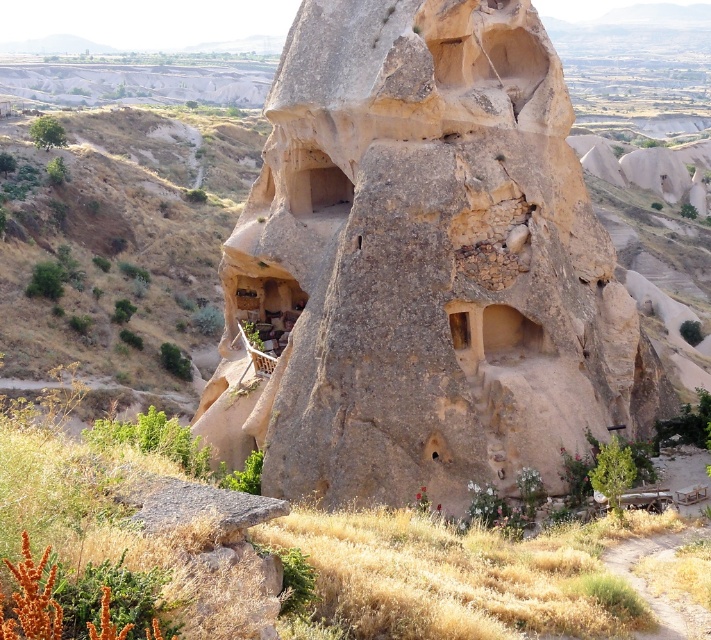
Who is positioned more to the left, brown rough rock formation at center or brown rough rock at lower left?

Positioned to the left is brown rough rock at lower left.

Between point (341, 237) and point (97, 186), which one is positioned behind?

Point (97, 186)

I want to click on brown rough rock formation at center, so click(422, 266).